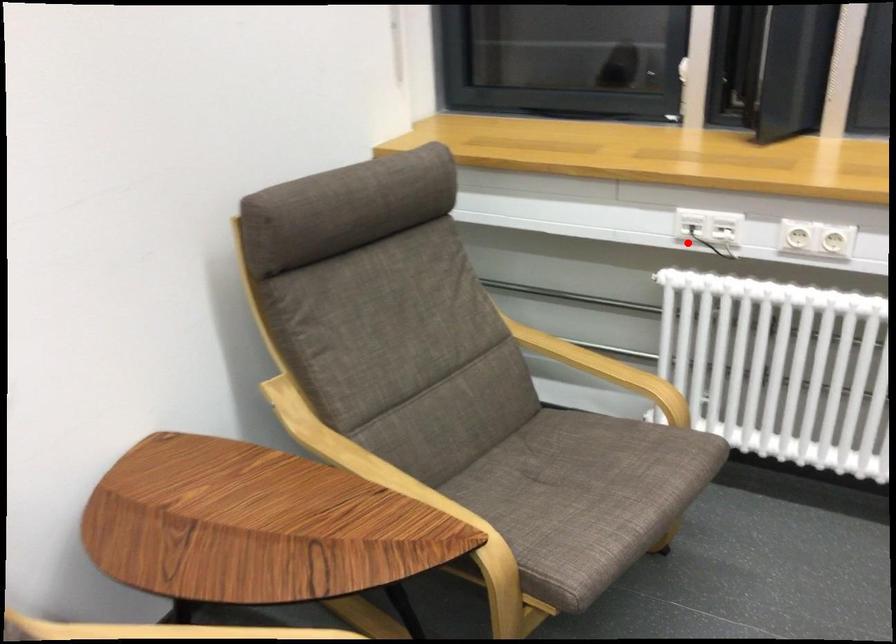
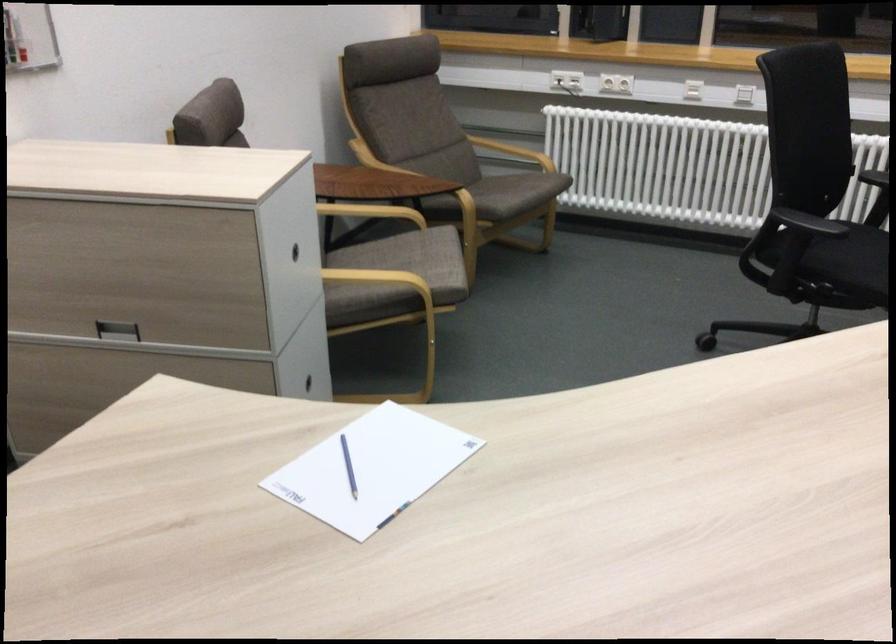
Question: A red point is marked in image1. In image2, is the corresponding 3D point closer to the camera or farther? Reply with the corresponding letter.

Choices:
 (A) The corresponding 3D point is closer.
 (B) The corresponding 3D point is farther.

Answer: (B)